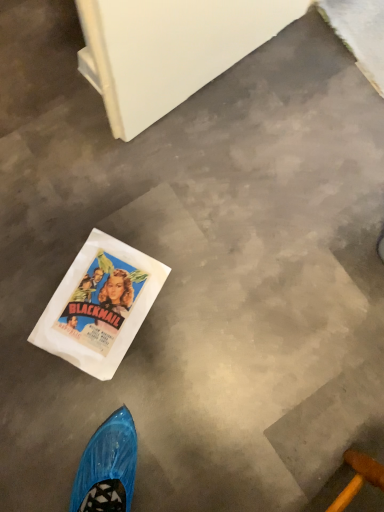
What is the approximate height of white paper comic book at lower left?

It is 0.39 inches.

Describe the element at coordinates (100, 305) in the screenshot. Image resolution: width=384 pixels, height=512 pixels. I see `white paper comic book at lower left` at that location.

Find the location of a particular element. This screenshot has height=512, width=384. white paper comic book at lower left is located at coordinates (100, 305).

Identify the location of white paper comic book at lower left. Image resolution: width=384 pixels, height=512 pixels. (100, 305).